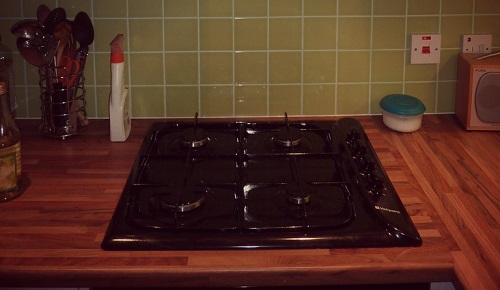
Locate an element on the screen. This screenshot has height=290, width=500. tile backsplash is located at coordinates (242, 54).